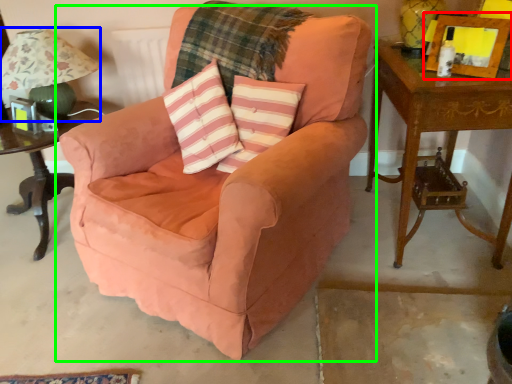
Question: Based on their relative distances, which object is farther from picture frame (highlighted by a red box)? Choose from table lamp (highlighted by a blue box) and chair (highlighted by a green box).

Choices:
 (A) table lamp
 (B) chair

Answer: (A)